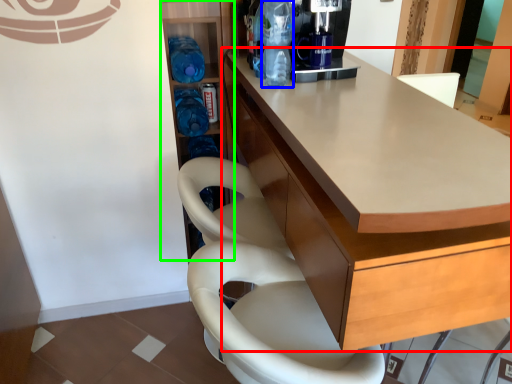
Question: Based on their relative distances, which object is farther from cabinetry (highlighted by a red box)? Choose from bottle (highlighted by a blue box) and shelf (highlighted by a green box).

Choices:
 (A) bottle
 (B) shelf

Answer: (B)